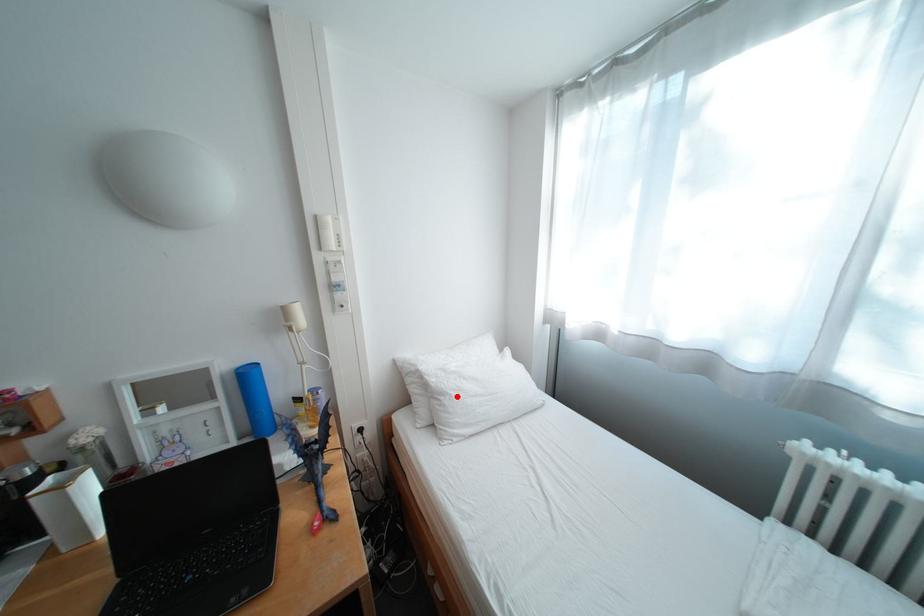
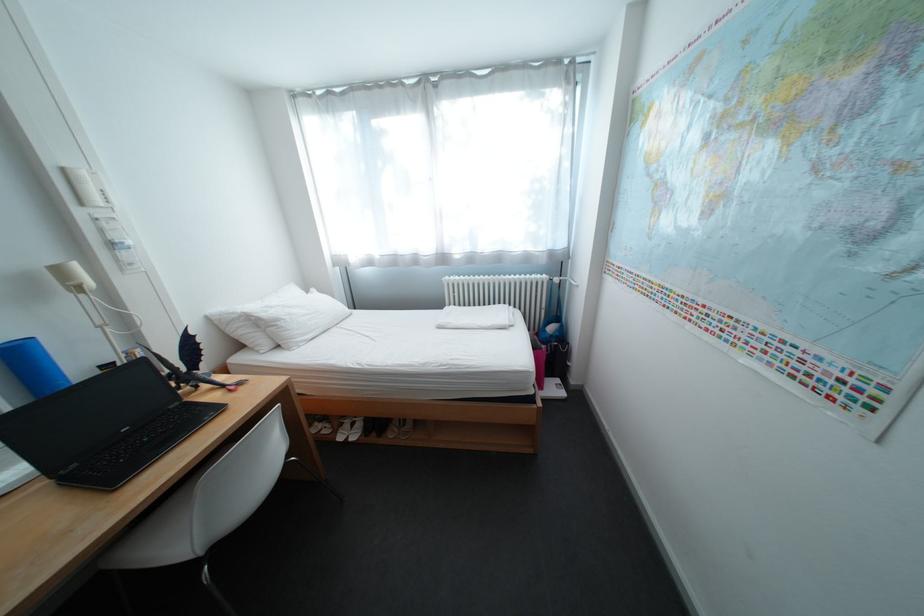
Locate, in the second image, the point that corresponds to the highlighted location in the first image.

(292, 322)